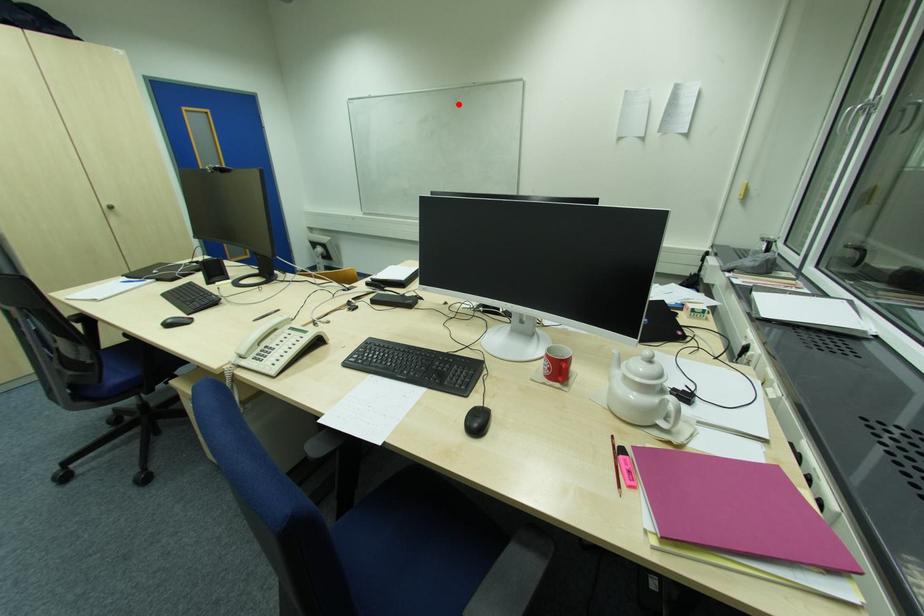
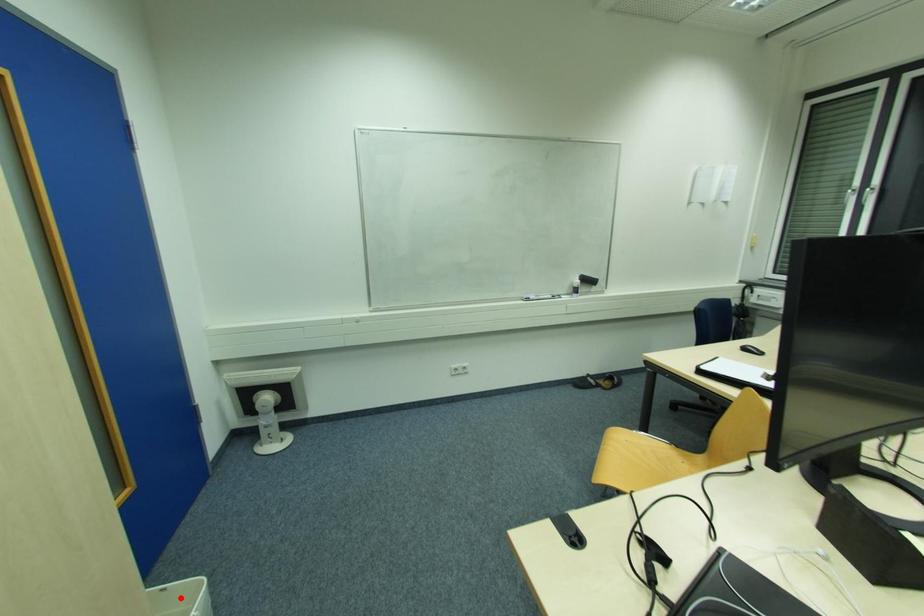
I am providing you with two images of the same scene from different viewpoints. A red point is marked on the first image and another point is marked on the second image. Does the point marked in image1 correspond to the same location as the one in image2?

No